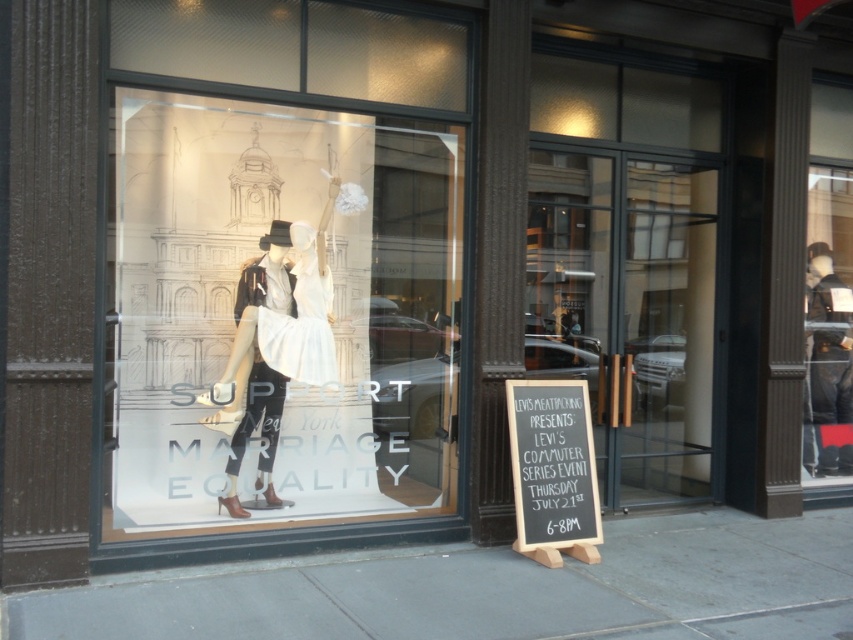
You are a customer standing outside the Levi store in New York. You see the matte glass mannequins at center and the white matte dress at center. Which object is closer to you?

The matte glass mannequins at center is positioned over white matte dress at center, so the matte glass mannequins at center is closer to you.

You are a window designer who needs to adjust the spacing between the matte glass mannequins at center and the white matte dress at center to ensure they are exactly 50 centimeters apart. Given their current distance is 42.80 centimeters, how much more space should you add between them?

The current distance between the matte glass mannequins at center and the white matte dress at center is 42.80 centimeters. To reach the desired 50 centimeters, you need to add 7.2 centimeters more space between them.

You are a customer who wants to take a photo of the white satin dress at center without the black chalkboard at lower right appearing in the shot. Is it possible to do so by adjusting your position?

The black chalkboard at lower right is much taller than the white satin dress at center, so it might be challenging to avoid capturing the chalkboard in the photo unless you move far enough away or angle your camera to exclude the taller chalkboard.